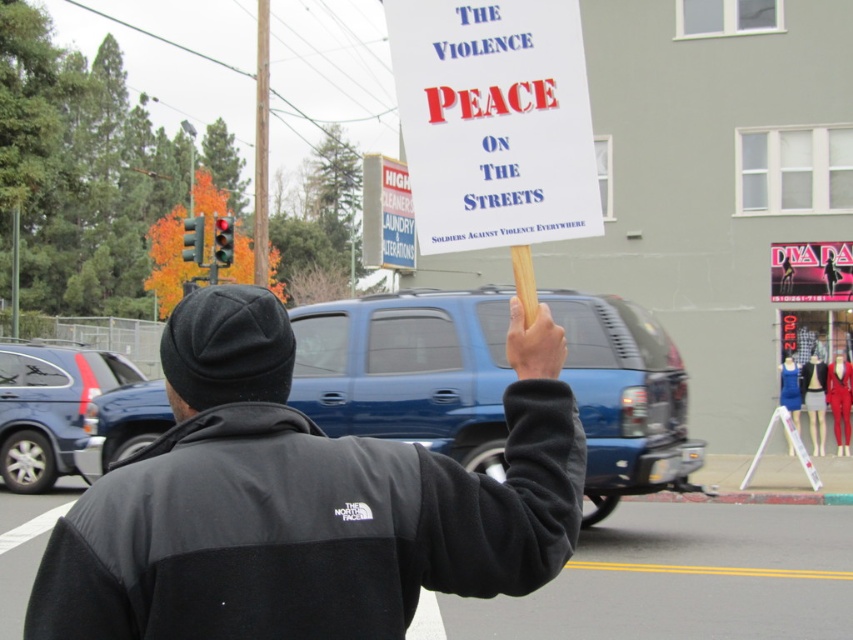
Question: Which object is closer to the camera taking this photo?

Choices:
 (A) white paper sign at upper center
 (B) black fleece jacket at center
 (C) matte blue suv at center

Answer: (B)

Question: Which point is closer to the camera taking this photo?

Choices:
 (A) (39, 467)
 (B) (445, 1)

Answer: (B)

Question: Does black fleece jacket at center appear over white paper sign at upper center?

Choices:
 (A) no
 (B) yes

Answer: (A)

Question: Can you confirm if black fleece jacket at center is positioned above matte blue suv at center?

Choices:
 (A) yes
 (B) no

Answer: (A)

Question: Based on their relative distances, which object is farther from the matte blue suv at center?

Choices:
 (A) white paper sign at upper center
 (B) black fleece jacket at center

Answer: (A)

Question: Can you confirm if white paper sign at upper center is positioned to the left of matte blue suv at center?

Choices:
 (A) no
 (B) yes

Answer: (A)